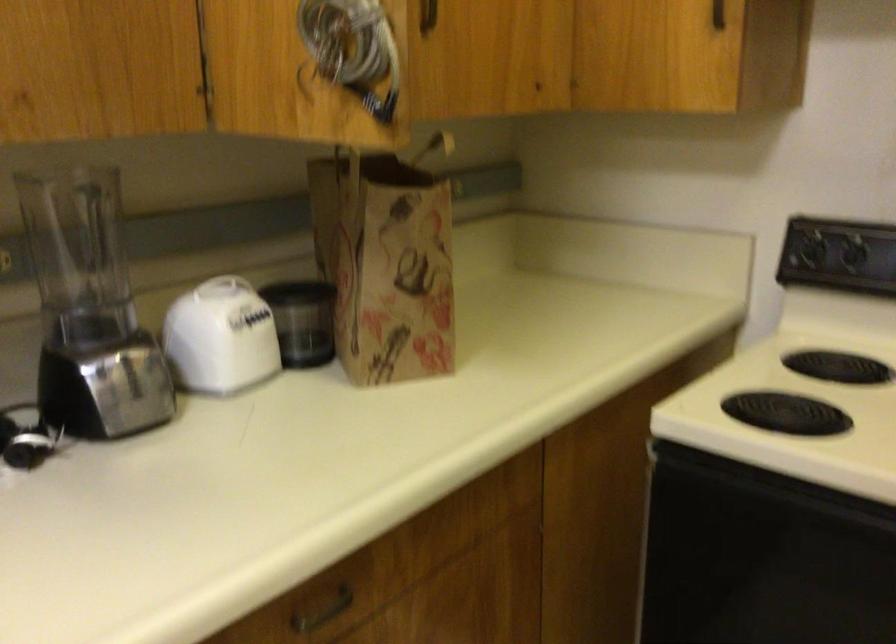
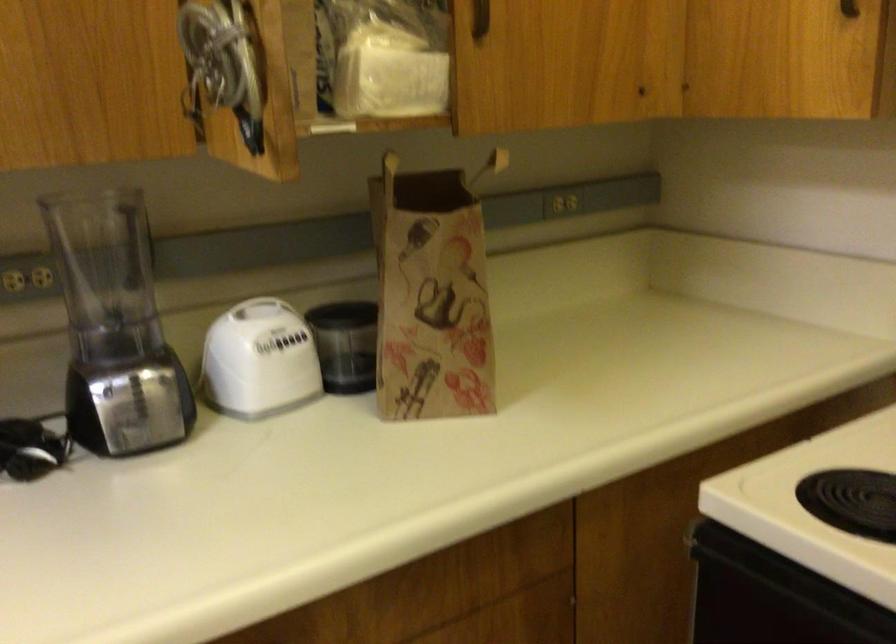
Where in the second image is the point corresponding to pixel 355 149 from the first image?

(389, 163)